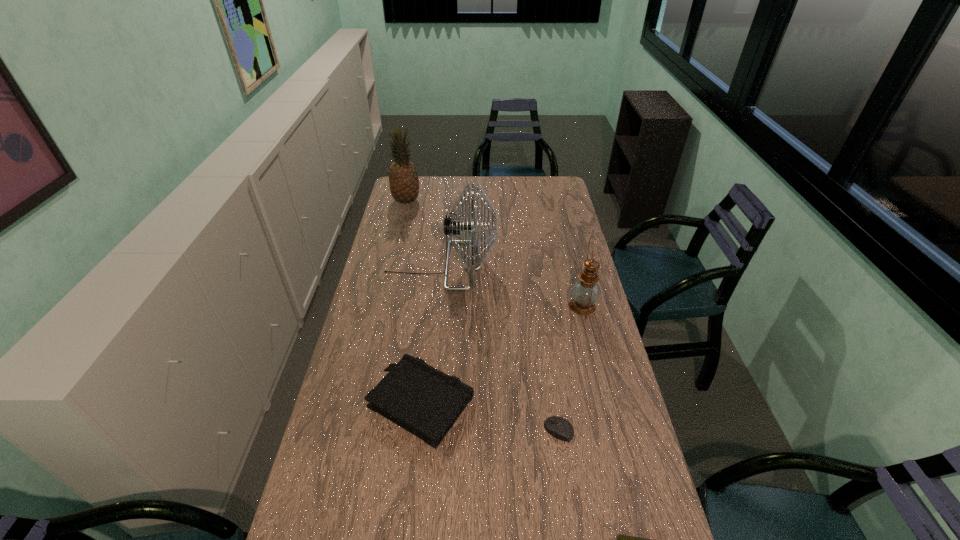
The width and height of the screenshot is (960, 540). Identify the location of the farthest object. (403, 178).

At what (x,y) coordinates should I click in order to perform the action: click on fan. Please return your answer as a coordinate pair (x, y). This screenshot has width=960, height=540. Looking at the image, I should click on pos(452,227).

Image resolution: width=960 pixels, height=540 pixels. I want to click on the third tallest object, so click(x=585, y=292).

Find the location of a particular element. the fourth tallest object is located at coordinates (426, 402).

In order to click on the third object from right to left in this screenshot , I will do `click(558, 427)`.

Identify the location of computer equipment. (558, 427).

This screenshot has width=960, height=540. Identify the location of free space located 0.120m on the back of the pineapple. (411, 182).

The width and height of the screenshot is (960, 540). In order to click on vacant space located 0.220m on the front-facing side of the fan in this screenshot , I will do `click(549, 266)`.

Find the location of a particular element. The width and height of the screenshot is (960, 540). vacant space located on the left of the oil lamp is located at coordinates (523, 307).

Identify the location of vacant space located 0.070m on the left of the Bible. The image size is (960, 540). pos(346,404).